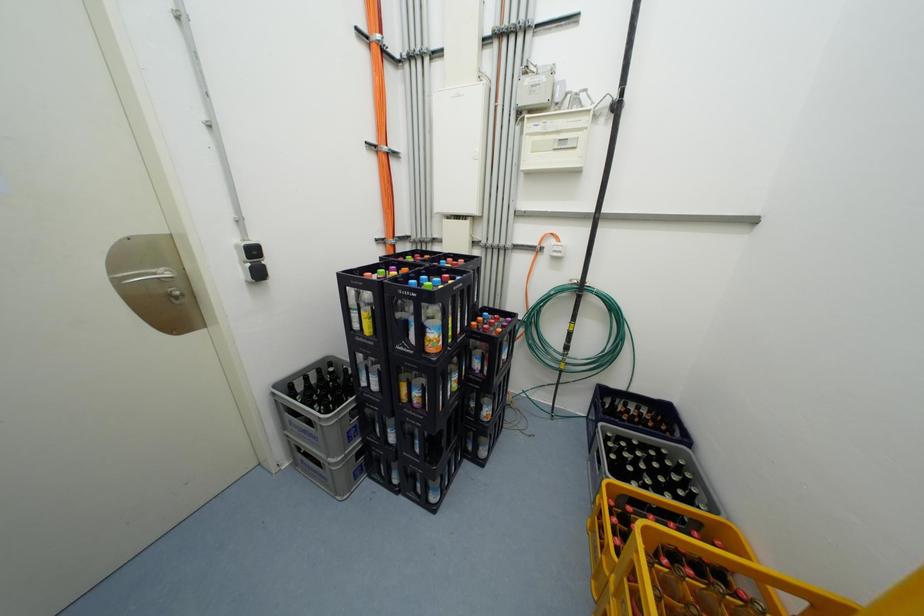
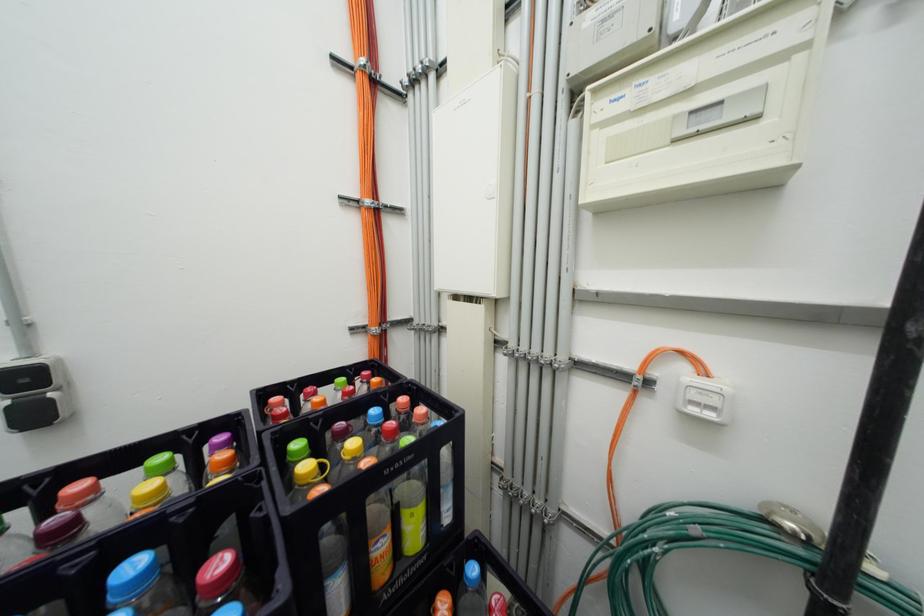
Question: The images are taken continuously from a first-person perspective. In which direction are you moving?

Choices:
 (A) Left
 (B) Right
 (C) Forward
 (D) Backward

Answer: (C)